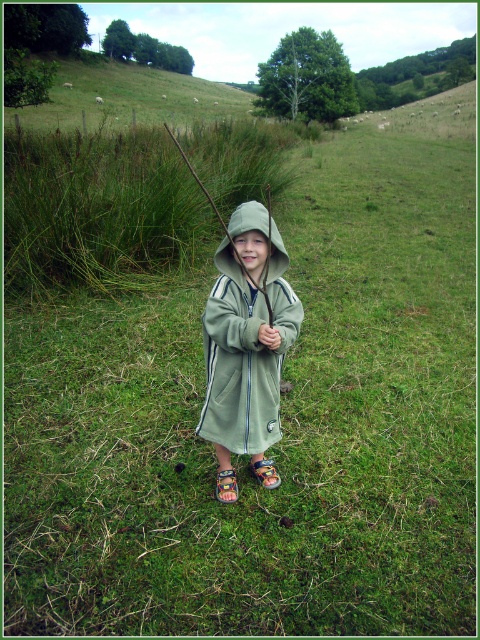
Between green fleece jacket at center and green wood stick at center, which one is positioned higher?

green wood stick at center is higher up.

Can you confirm if green fleece jacket at center is wider than green wood stick at center?

In fact, green fleece jacket at center might be narrower than green wood stick at center.

Who is more forward, (276, 410) or (268, 257)?

Point (268, 257)

Find the location of `green fleece jacket at center`. green fleece jacket at center is located at coordinates (247, 348).